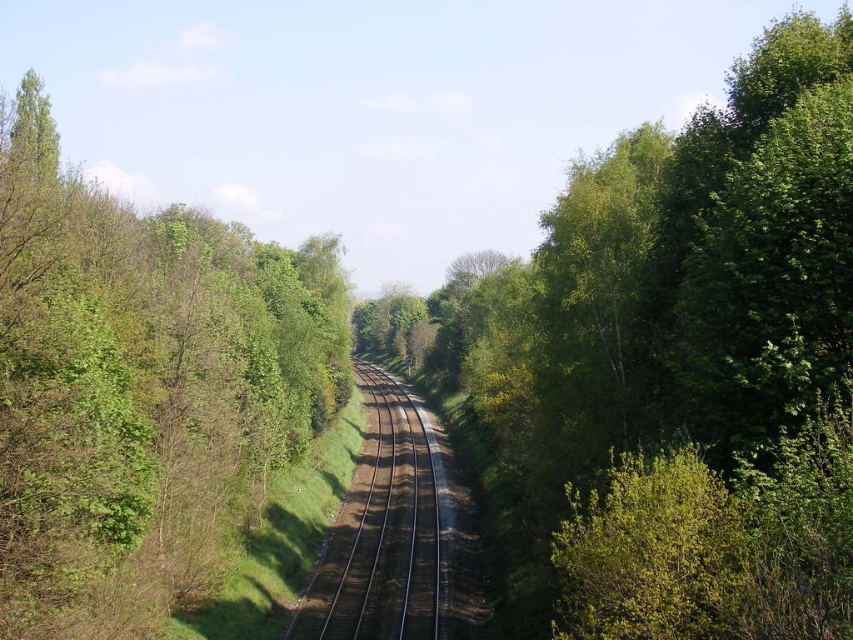
Can you confirm if green leafy tree at left is positioned to the left of brown/gravel track at center?

Yes, green leafy tree at left is to the left of brown/gravel track at center.

Does point (13, 336) come closer to viewer compared to point (437, 564)?

Yes, it is.

Does point (189, 476) come behind point (387, 445)?

No.

Where is `green leafy tree at left`? green leafy tree at left is located at coordinates (141, 388).